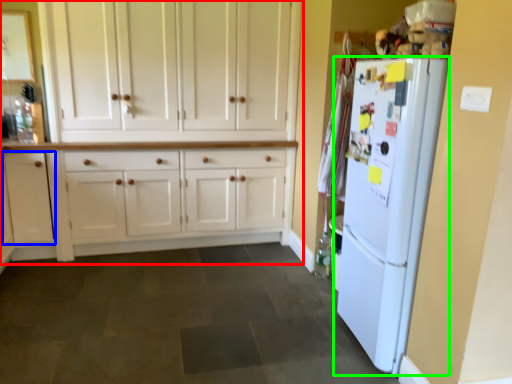
Question: Based on their relative distances, which object is nearer to cabinetry (highlighted by a red box)? Choose from cabinetry (highlighted by a blue box) and refrigerator (highlighted by a green box).

Choices:
 (A) cabinetry
 (B) refrigerator

Answer: (A)